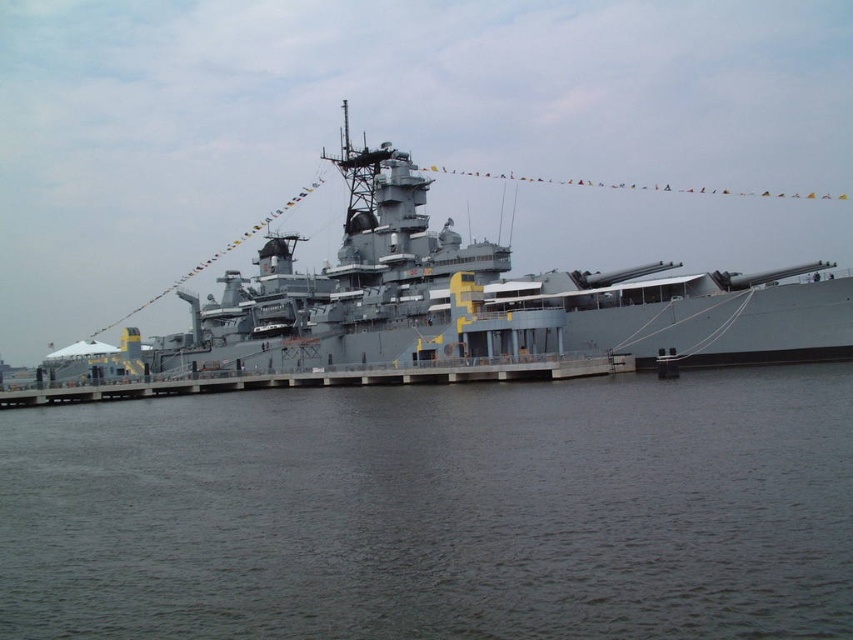
Question: Among these objects, which one is nearest to the camera?

Choices:
 (A) gray concrete dock at center
 (B) dark gray water at lower center
 (C) gray metallic battleship at center

Answer: (B)

Question: Which point appears farthest from the camera in this image?

Choices:
 (A) (328, 292)
 (B) (234, 385)
 (C) (426, 515)

Answer: (A)

Question: Does dark gray water at lower center have a smaller size compared to gray metallic battleship at center?

Choices:
 (A) yes
 (B) no

Answer: (A)

Question: Where is dark gray water at lower center located in relation to gray metallic battleship at center in the image?

Choices:
 (A) below
 (B) above

Answer: (A)

Question: Can you confirm if gray metallic battleship at center is bigger than gray concrete dock at center?

Choices:
 (A) yes
 (B) no

Answer: (A)

Question: Which is nearer to the dark gray water at lower center?

Choices:
 (A) gray metallic battleship at center
 (B) gray concrete dock at center

Answer: (B)